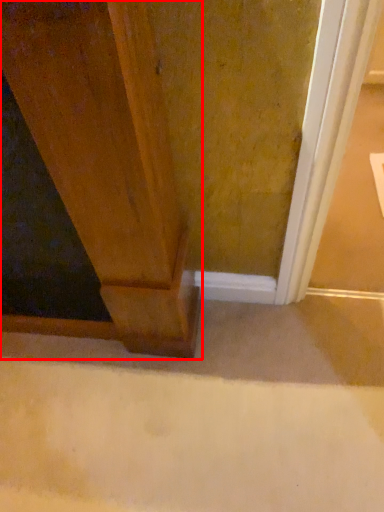
Question: In this image, where is door (annotated by the red box) located relative to concrete?

Choices:
 (A) right
 (B) left

Answer: (B)